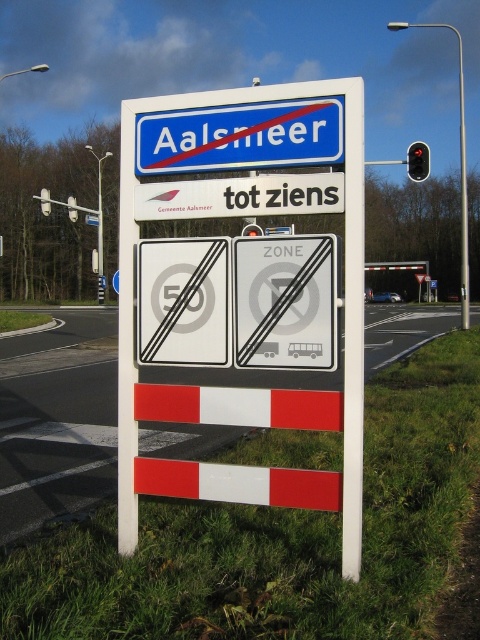
You are driving a car and see the blue plastic sign at upper center and the red glass traffic light at upper right. Which object is taller?

The red glass traffic light at upper right is taller than the blue plastic sign at upper center.

You are standing at the roadside and see the blue plastic sign at upper center. If your car is 1.8 meters tall, can you drive under it without hitting the sign?

The blue plastic sign at upper center is 3.43 meters away from the viewer. Since the distance is greater than the car height of 1.8 meters, the car can safely pass under it without hitting the sign.